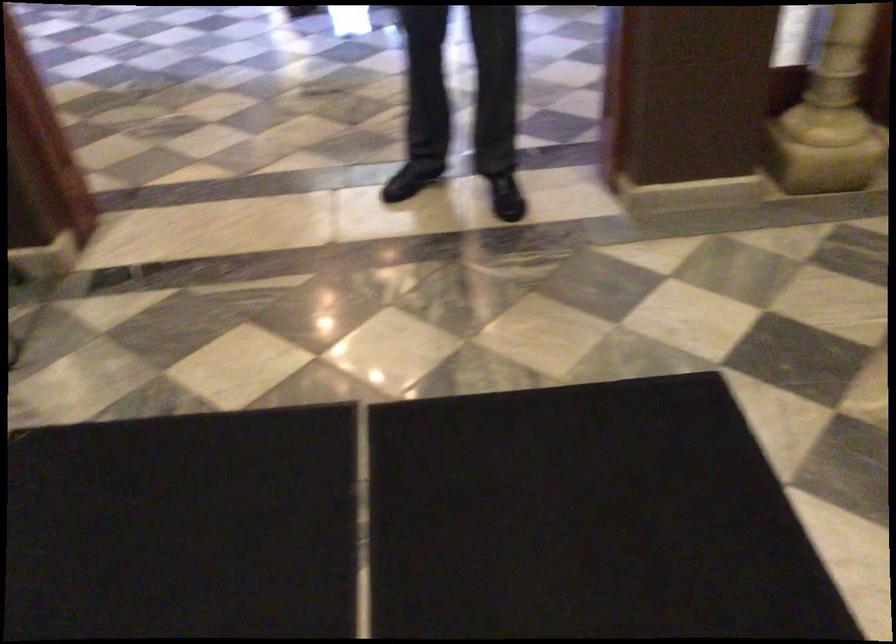
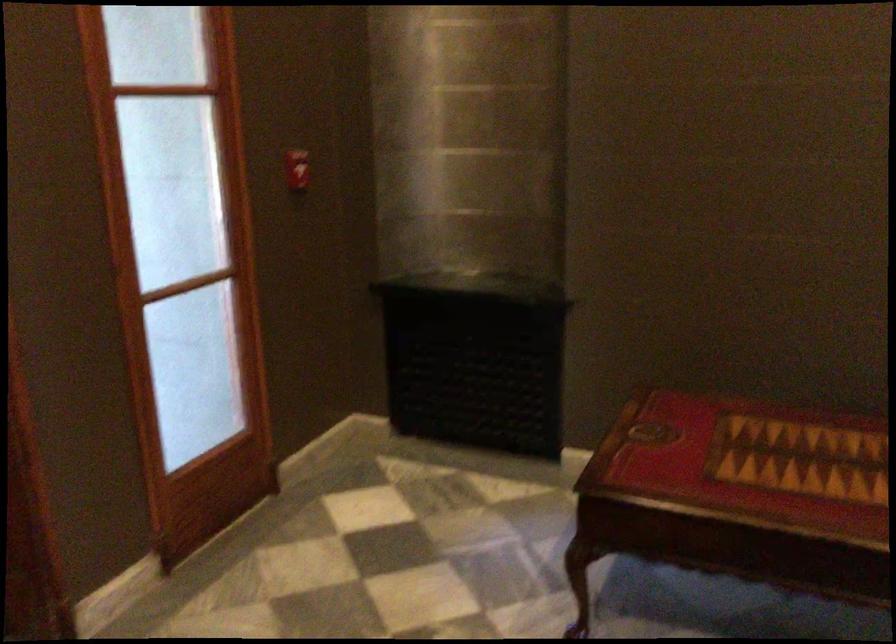
The first image is from the beginning of the video and the second image is from the end. How did the camera likely rotate when shooting the video?

The camera's rotation is toward left-down.